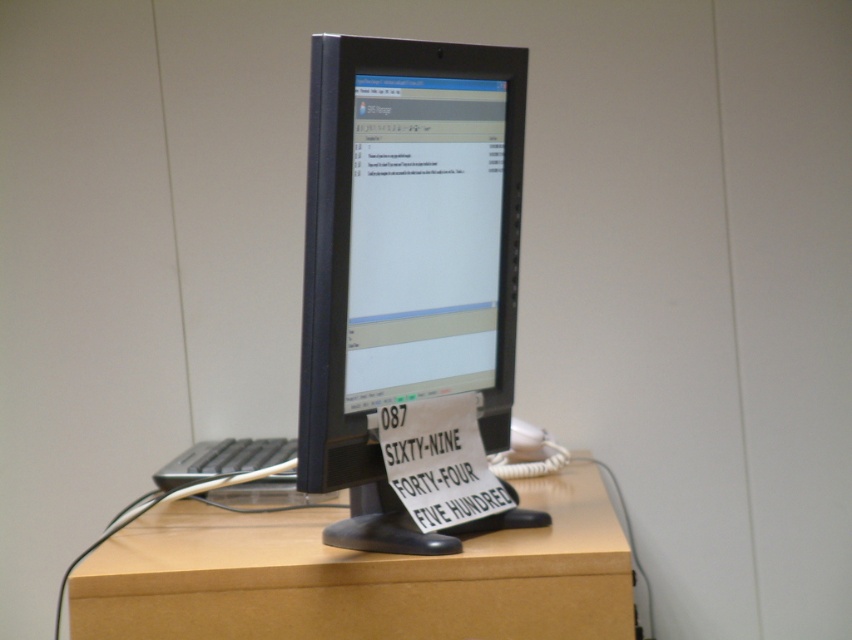
Question: Is matte black monitor at center above light brown wood at center?

Choices:
 (A) no
 (B) yes

Answer: (B)

Question: Among these objects, which one is nearest to the camera?

Choices:
 (A) light brown wood at center
 (B) matte black monitor at center

Answer: (B)

Question: Does matte black monitor at center appear under light brown wood at center?

Choices:
 (A) yes
 (B) no

Answer: (B)

Question: Does matte black monitor at center appear under light brown wood at center?

Choices:
 (A) no
 (B) yes

Answer: (A)